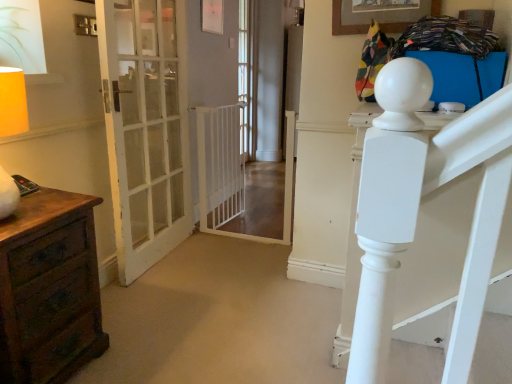
This screenshot has height=384, width=512. What are the coordinates of `free space in front of white glass door at left` in the screenshot? It's located at (157, 294).